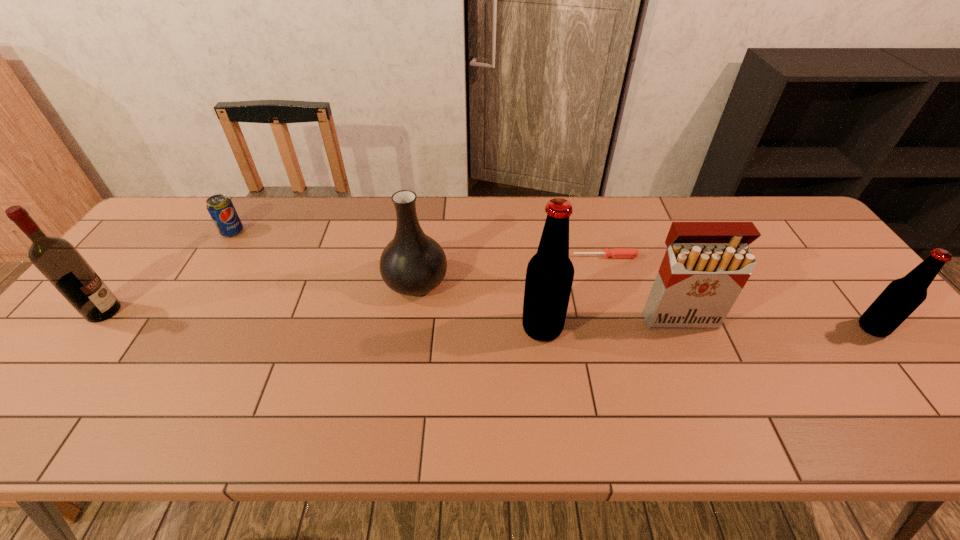
Where is `empty space between the fourth object from right to left and the alcohol`? This screenshot has width=960, height=540. empty space between the fourth object from right to left and the alcohol is located at coordinates (323, 320).

The image size is (960, 540). What are the coordinates of `free space that is in between the alcohol and the fourth object from left to right` in the screenshot? It's located at [323, 320].

Select which object is the third closest to the cigarette case. Please provide its 2D coordinates. Your answer should be formatted as a tuple, i.e. [(x, y)], where the tuple contains the x and y coordinates of a point satisfying the conditions above.

[(903, 296)]

Where is `object that is the fourth closest to the right beer bottle`? The width and height of the screenshot is (960, 540). object that is the fourth closest to the right beer bottle is located at coordinates (412, 264).

The image size is (960, 540). What are the coordinates of `free region that satisfies the following two spatial constraints: 1. on the front side of the soda; 2. on the front and back of the alcohol` in the screenshot? It's located at (182, 312).

Find the location of a particular element. The height and width of the screenshot is (540, 960). free region that satisfies the following two spatial constraints: 1. on the front side of the shorter beer bottle; 2. on the right side of the fourth object from right to left is located at coordinates (542, 328).

Image resolution: width=960 pixels, height=540 pixels. What are the coordinates of `free region that satisfies the following two spatial constraints: 1. on the front and back of the alcohol; 2. on the back side of the left beer bottle` in the screenshot? It's located at pos(90,328).